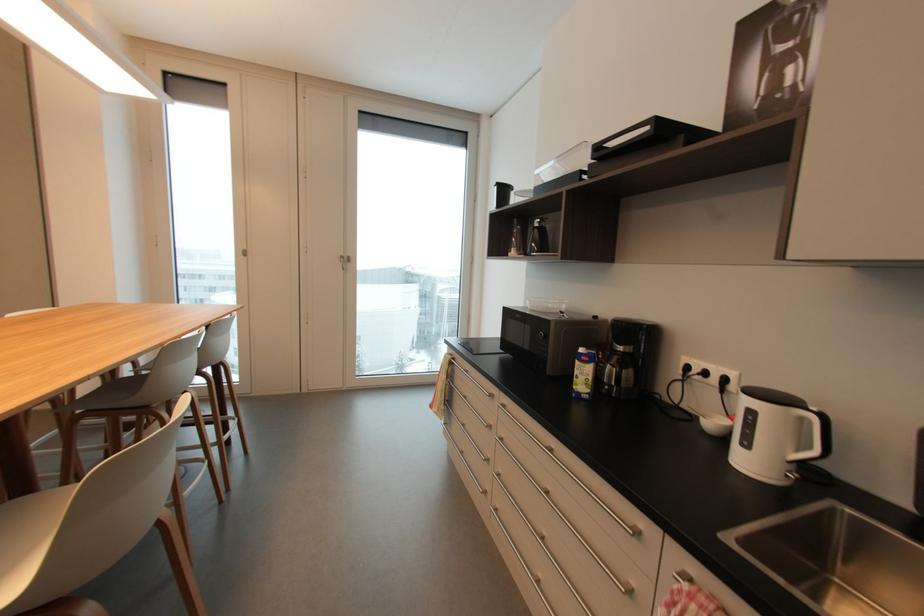
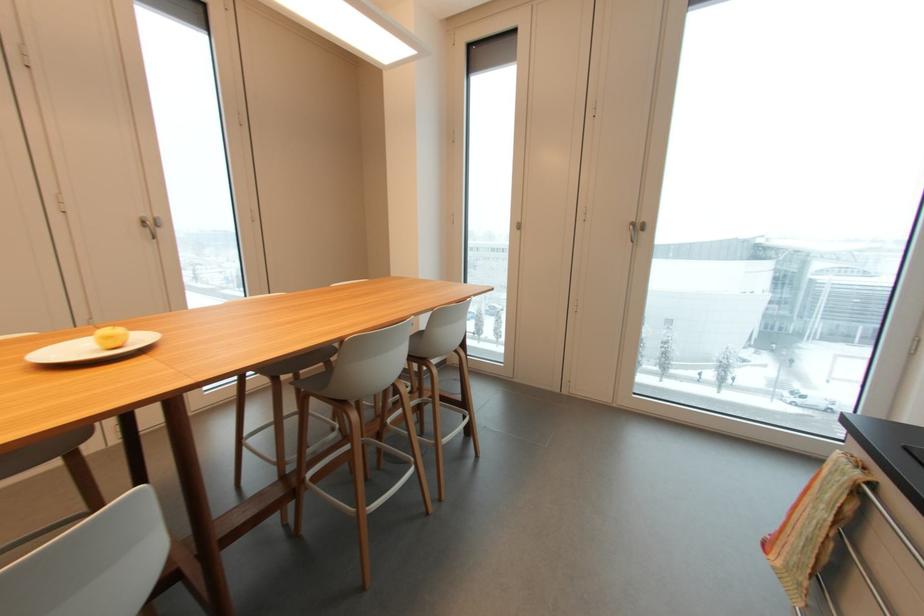
Locate, in the second image, the point that corresponds to point 453,382 in the first image.

(843, 533)